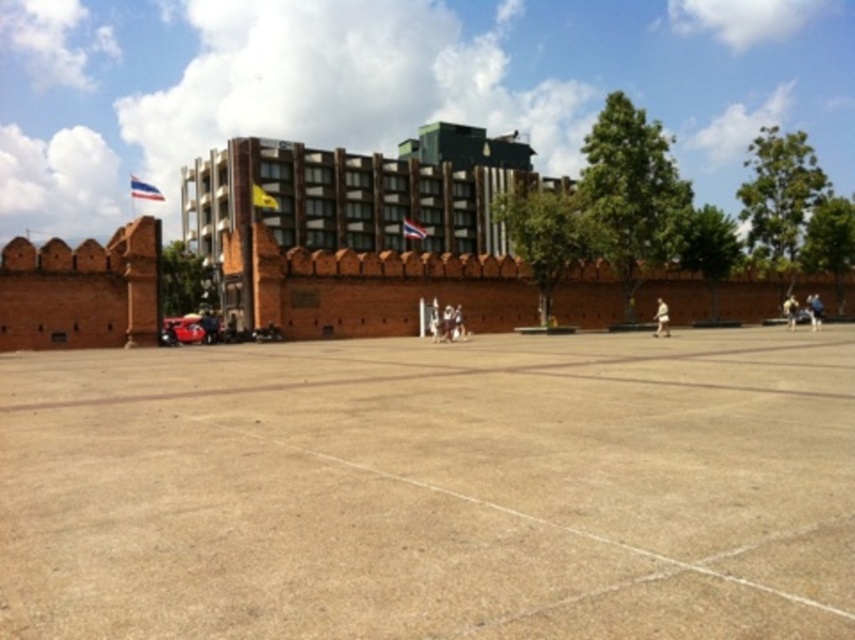
You are standing at the edge of the plaza and see the brick wall at center and the brown leather jacket at lower right. Which object is higher in the image?

The brick wall at center is above the brown leather jacket at lower right, so the brick wall at center is higher in the image.

You are standing in the plaza and want to walk towards the point that is closer to you. Which point should you head towards, point (46, 440) or point (328, 284)?

A: You should head towards point (46, 440) because it is closer to the viewer than point (328, 284).